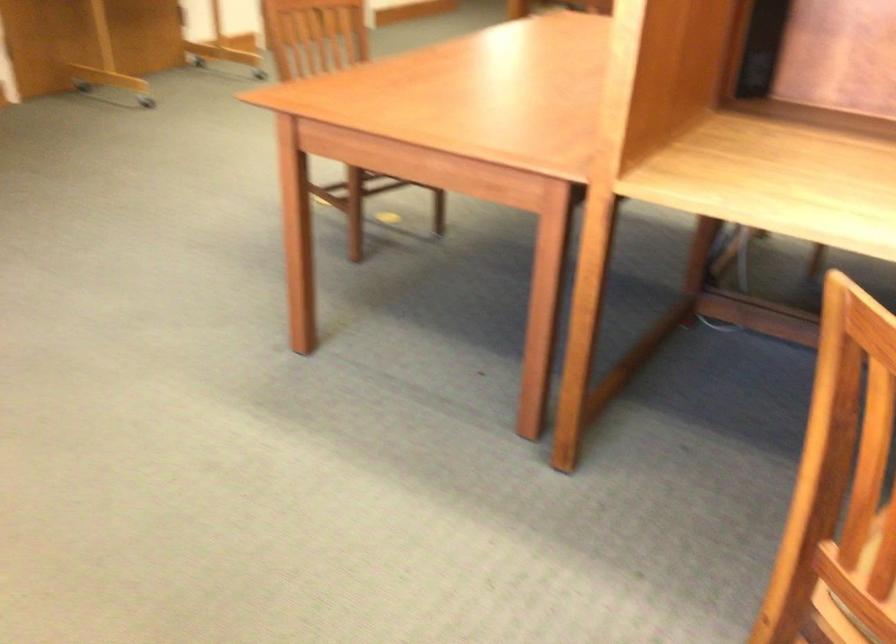
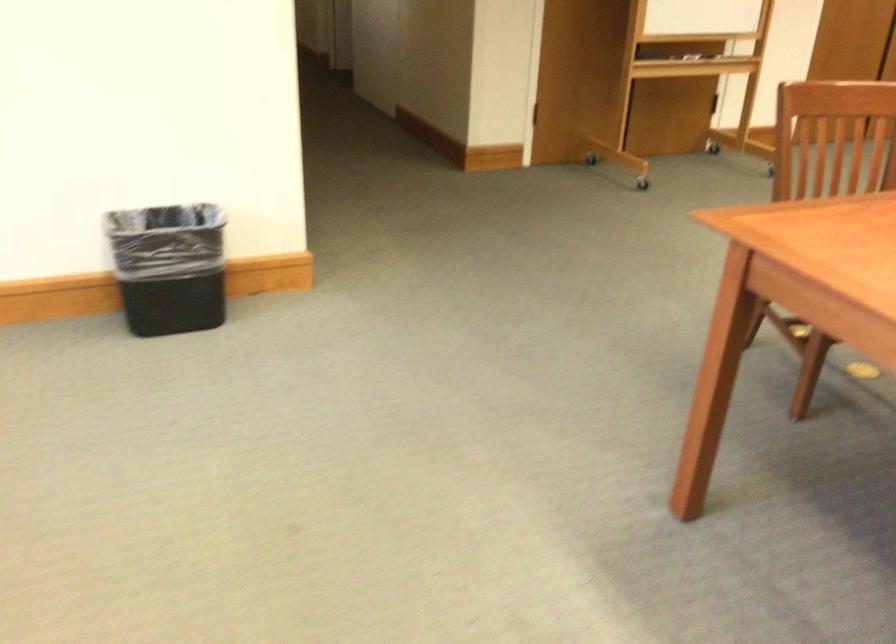
Question: The first image is from the beginning of the video and the second image is from the end. How did the camera likely rotate when shooting the video?

Choices:
 (A) Left
 (B) Right
 (C) Up
 (D) Down

Answer: (A)